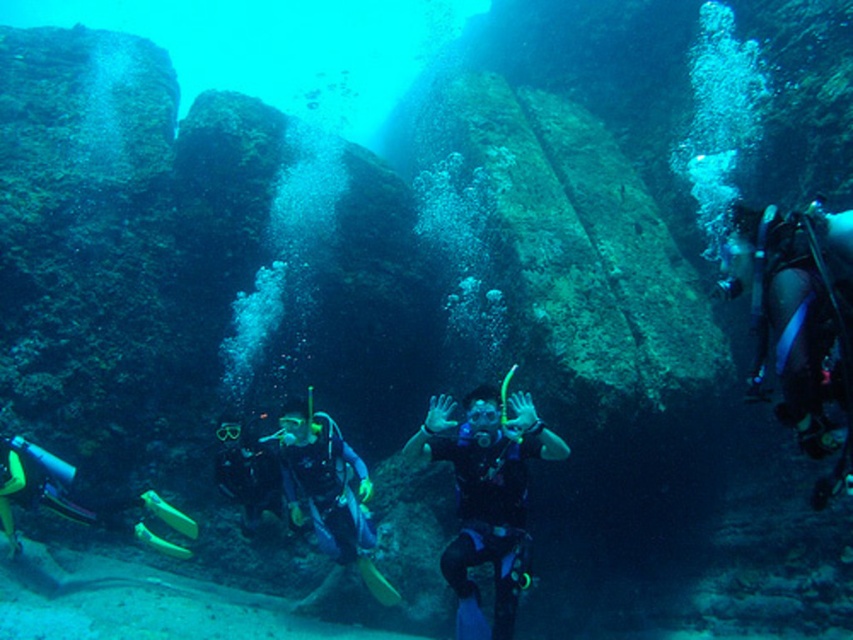
Does matte black scuba diver at right appear under black rubber diving suit at center?

No.

Who is taller, matte black scuba diver at right or black rubber diving suit at center?

With more height is matte black scuba diver at right.

Is point (842, 291) closer to viewer compared to point (248, 516)?

Yes, point (842, 291) is in front of point (248, 516).

The image size is (853, 640). I want to click on matte black scuba diver at right, so click(x=786, y=317).

Consider the image. Can you confirm if black matte scuba diver at center is positioned to the left of matte black scuba diver at right?

Yes, black matte scuba diver at center is to the left of matte black scuba diver at right.

Is black matte scuba diver at center smaller than matte black scuba diver at right?

Incorrect, black matte scuba diver at center is not smaller in size than matte black scuba diver at right.

Consider the image. Who is more distant from viewer, (525, 392) or (833, 246)?

Point (525, 392)

The image size is (853, 640). Find the location of `black matte scuba diver at center`. black matte scuba diver at center is located at coordinates (x=486, y=497).

Is matte black scuba diver at right wider than blue matte scuba diver at center?

No, matte black scuba diver at right is not wider than blue matte scuba diver at center.

Does point (763, 356) come farther from viewer compared to point (318, 525)?

No, it is in front of (318, 525).

Is point (792, 356) in front of point (292, 484)?

That is True.

The height and width of the screenshot is (640, 853). I want to click on matte black scuba diver at right, so click(786, 317).